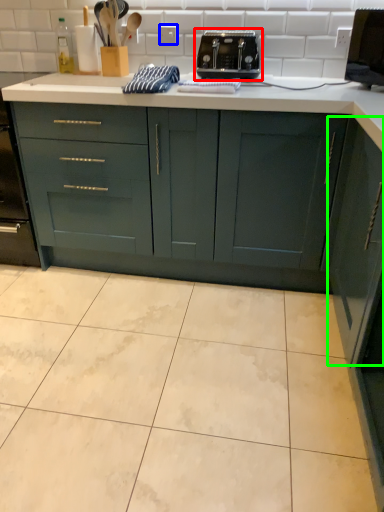
Question: Which object is positioned closest to toaster (highlighted by a red box)? Select from electric outlet (highlighted by a blue box) and cabinetry (highlighted by a green box).

Choices:
 (A) electric outlet
 (B) cabinetry

Answer: (A)